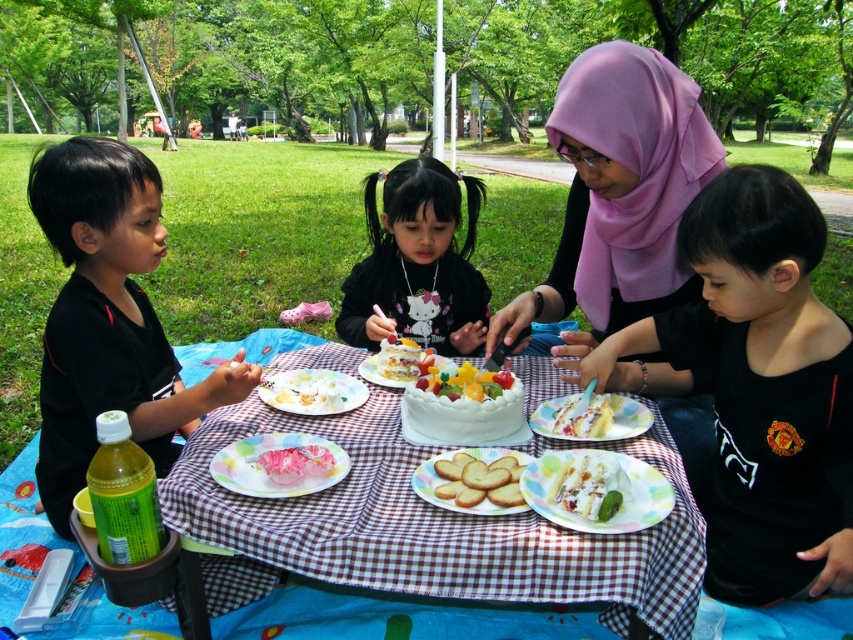
Question: Which of the following is the farthest from the observer?

Choices:
 (A) black matte shirt at lower right
 (B) golden crispy cookies at center

Answer: (A)

Question: Which point is farther to the camera?

Choices:
 (A) shiny pink cake at center
 (B) pastel floral plate at center
 (C) yellow cake at center

Answer: (C)

Question: In this image, where is black matte shirt at left located relative to white creamy cake at center?

Choices:
 (A) right
 (B) left

Answer: (B)

Question: Is whipped cream cake at center further to camera compared to yellow cake at center?

Choices:
 (A) yes
 (B) no

Answer: (B)

Question: Where is black matte shirt at lower right located in relation to shiny pink cake at center in the image?

Choices:
 (A) above
 (B) below

Answer: (A)

Question: Which object appears farthest from the camera in this image?

Choices:
 (A) yellow cake at center
 (B) purple satin hijab at center

Answer: (B)